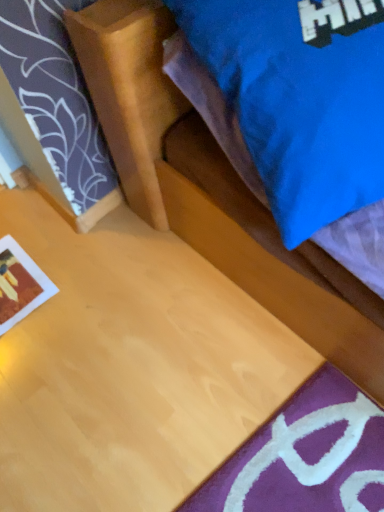
The height and width of the screenshot is (512, 384). What are the coordinates of `blank space above matte paper print at lower left (from a real-world perspective)` in the screenshot? It's located at (15, 276).